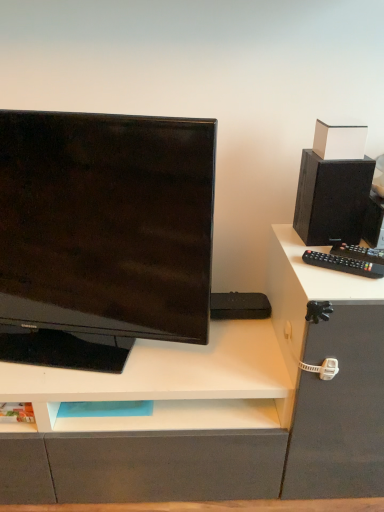
At what (x,y) coordinates should I click in order to perform the action: click on white matte box at upper right. Please return your answer as a coordinate pair (x, y). This screenshot has width=384, height=512. Looking at the image, I should click on (339, 141).

This screenshot has width=384, height=512. In order to click on black matte speaker at upper right in this screenshot , I will do `click(332, 199)`.

Identify the location of white matte box at upper right. The image size is (384, 512). (339, 141).

In order to click on remote control located underneath the matte black monitor at left (from a real-world perspective) in this screenshot , I will do `click(344, 264)`.

From a real-world perspective, which is physically above, black plastic remote control at right or matte black monitor at left?

In real-world perspective, matte black monitor at left is above.

Is black plastic remote control at right to the left or to the right of matte black monitor at left in the image?

black plastic remote control at right is positioned on matte black monitor at left's right side.

Is black plastic remote control at right beside matte black monitor at left?

They are not placed beside each other.

Considering the positions of points (4, 346) and (358, 270), is point (4, 346) farther from camera compared to point (358, 270)?

That is True.

Does matte black monitor at left have a smaller size compared to black plastic remote control at right?

No.

From a real-world perspective, is matte black monitor at left above or below black plastic remote control at right?

matte black monitor at left is situated higher than black plastic remote control at right in the real world.

Considering the positions of objects black matte speaker at upper right and white matte box at upper right in the image provided, who is more to the right, black matte speaker at upper right or white matte box at upper right?

black matte speaker at upper right is more to the right.

Where is `speaker on the right of the white matte box at upper right`? The image size is (384, 512). speaker on the right of the white matte box at upper right is located at coordinates (332, 199).

From a real-world perspective, who is located higher, black matte speaker at upper right or white matte box at upper right?

white matte box at upper right, from a real-world perspective.

Would you say black matte speaker at upper right is a long distance from white matte box at upper right?

They are positioned close to each other.

From a real-world perspective, does black plastic remote control at right sit lower than white matte box at upper right?

Yes, from a real-world perspective, black plastic remote control at right is beneath white matte box at upper right.

From the image's perspective, who appears lower, black plastic remote control at right or white matte box at upper right?

black plastic remote control at right is shown below in the image.

In terms of height, does black plastic remote control at right look taller or shorter compared to white matte box at upper right?

Considering their sizes, black plastic remote control at right has less height than white matte box at upper right.

Is black plastic remote control at right aimed at white matte box at upper right?

No, black plastic remote control at right is not oriented towards white matte box at upper right.

Is white matte box at upper right smaller than black plastic remote control at right?

No.

From the image's perspective, is white matte box at upper right positioned above or below black plastic remote control at right?

white matte box at upper right is situated higher than black plastic remote control at right in the image.

Is black plastic remote control at right at the back of white matte box at upper right?

No.

In the scene shown: Considering the sizes of objects white matte box at upper right and black plastic remote control at right in the image provided, who is shorter, white matte box at upper right or black plastic remote control at right?

With less height is black plastic remote control at right.

Does point (328, 126) come closer to viewer compared to point (97, 260)?

No.

Where is `box on the right of matte black monitor at left`? box on the right of matte black monitor at left is located at coordinates (339, 141).

Based on their positions, is white matte box at upper right located to the left or right of matte black monitor at left?

Based on their positions, white matte box at upper right is located to the right of matte black monitor at left.

Is white matte box at upper right taller than matte black monitor at left?

No.

Can you tell me how much black matte speaker at upper right and black plastic remote control at right differ in facing direction?

33.2 degrees separate the facing orientations of black matte speaker at upper right and black plastic remote control at right.

From a real-world perspective, is black matte speaker at upper right under black plastic remote control at right?

No.

Does point (365, 186) come closer to viewer compared to point (309, 261)?

Yes, it is in front of point (309, 261).

Is black matte speaker at upper right situated inside black plastic remote control at right or outside?

black matte speaker at upper right is spatially situated outside black plastic remote control at right.

The image size is (384, 512). In order to click on remote control behind the matte black monitor at left in this screenshot , I will do `click(344, 264)`.

This screenshot has width=384, height=512. In order to click on computer monitor located above the black plastic remote control at right (from a real-world perspective) in this screenshot , I will do `click(103, 234)`.

Which object lies further to the anchor point black matte speaker at upper right, black plastic remote control at right or matte black monitor at left?

matte black monitor at left.

Based on their spatial positions, is white matte box at upper right or matte black monitor at left further from black plastic remote control at right?

matte black monitor at left is positioned further to the anchor black plastic remote control at right.

Based on their spatial positions, is white matte box at upper right or black matte speaker at upper right further from matte black monitor at left?

The object further to matte black monitor at left is white matte box at upper right.

Which object lies nearer to the anchor point black matte speaker at upper right, matte black monitor at left or black plastic remote control at right?

black plastic remote control at right is positioned closer to the anchor black matte speaker at upper right.

Looking at the image, which one is located closer to black matte speaker at upper right, black plastic remote control at right or white matte box at upper right?

white matte box at upper right is closer to black matte speaker at upper right.

Which object lies further to the anchor point black plastic remote control at right, black matte speaker at upper right or matte black monitor at left?

The object further to black plastic remote control at right is matte black monitor at left.

Estimate the real-world distances between objects in this image. Which object is further from matte black monitor at left, black plastic remote control at right or black matte speaker at upper right?

black plastic remote control at right lies further to matte black monitor at left than the other object.

Estimate the real-world distances between objects in this image. Which object is closer to matte black monitor at left, white matte box at upper right or black plastic remote control at right?

The object closer to matte black monitor at left is black plastic remote control at right.

You are a GUI agent. You are given a task and a screenshot of the screen. Output one action in this format:
    pyautogui.click(x=<x>, y=<y>)
    Task: Click on the remote control situated between matte black monitor at left and white matte box at upper right from left to right
    The height and width of the screenshot is (512, 384).
    Given the screenshot: What is the action you would take?
    pyautogui.click(x=344, y=264)

Find the location of a particular element. The width and height of the screenshot is (384, 512). speaker between white matte box at upper right and black plastic remote control at right vertically is located at coordinates (332, 199).

This screenshot has height=512, width=384. Find the location of `box located between matte black monitor at left and black matte speaker at upper right in the left-right direction`. box located between matte black monitor at left and black matte speaker at upper right in the left-right direction is located at coordinates (339, 141).

In order to click on remote control situated between matte black monitor at left and black matte speaker at upper right from left to right in this screenshot , I will do coord(344,264).